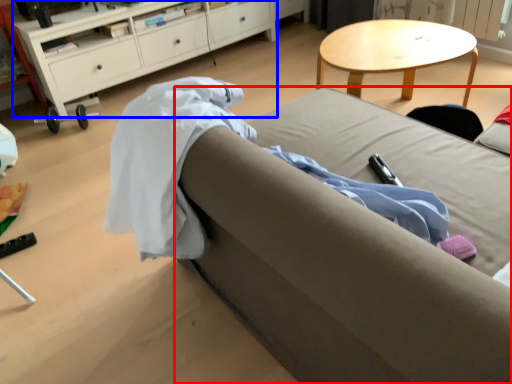
Question: Which object appears farthest to the camera in this image, studio couch (highlighted by a red box) or cabinetry (highlighted by a blue box)?

Choices:
 (A) studio couch
 (B) cabinetry

Answer: (B)